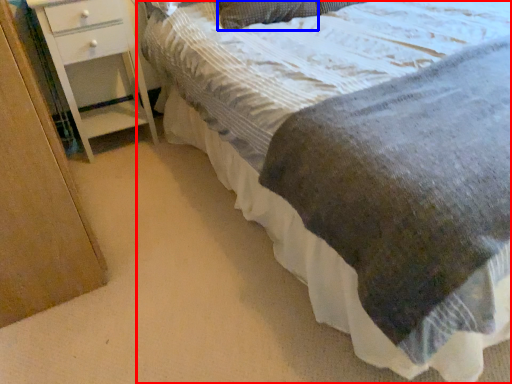
Question: Which of the following is the closest to the observer, bed (highlighted by a red box) or pillow (highlighted by a blue box)?

Choices:
 (A) bed
 (B) pillow

Answer: (A)